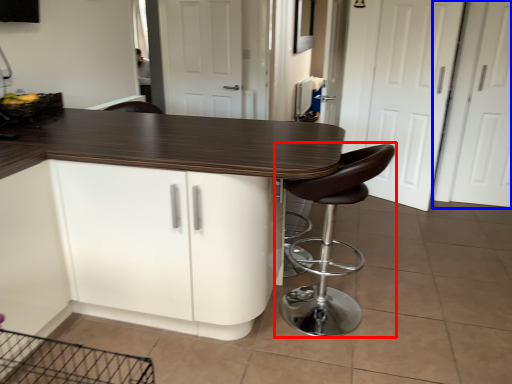
Question: Which of the following is the closest to the observer, chair (highlighted by a red box) or screen door (highlighted by a blue box)?

Choices:
 (A) chair
 (B) screen door

Answer: (A)